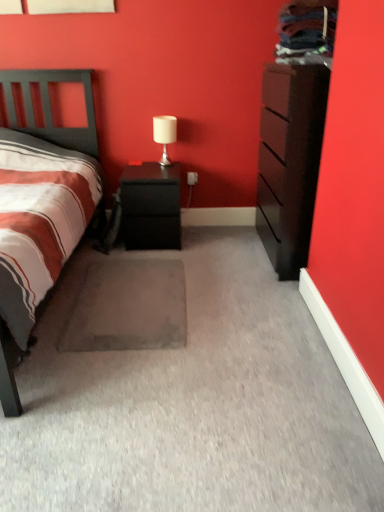
At what (x,y) coordinates should I click in order to perform the action: click on spots to the right of gray carpet at center. Please return your answer as a coordinate pair (x, y). The width and height of the screenshot is (384, 512). Looking at the image, I should click on (x=240, y=304).